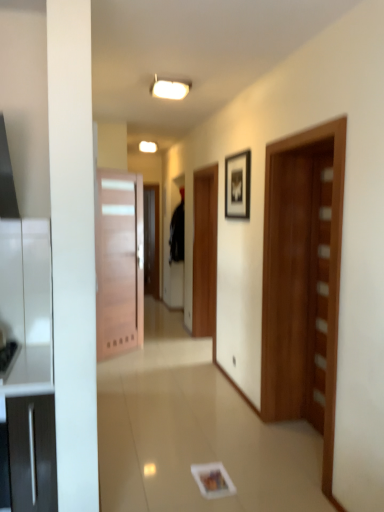
What is the approximate height of white glossy ceiling light at upper center?

2.76 inches.

Where is `wooden door at right, the first door viewed from the front`? Image resolution: width=384 pixels, height=512 pixels. wooden door at right, the first door viewed from the front is located at coordinates (302, 274).

What is the approximate height of black matte picture frame at upper center?

It is 22.66 inches.

Describe the element at coordinates (237, 186) in the screenshot. I see `black matte picture frame at upper center` at that location.

Find the location of a particular element. The height and width of the screenshot is (512, 384). wooden door at left, the 2th door from the front is located at coordinates (119, 263).

Describe the element at coordinates (119, 263) in the screenshot. This screenshot has width=384, height=512. I see `wooden door at left, which appears as the 2th door when viewed from the right` at that location.

Locate an element on the screen. white glossy ceiling light at upper center is located at coordinates (170, 88).

Is black fabric robe at center aimed at white glossy ceiling light at upper center?

No, black fabric robe at center does not turn towards white glossy ceiling light at upper center.

In terms of height, does black fabric robe at center look taller or shorter compared to white glossy ceiling light at upper center?

Clearly, black fabric robe at center is taller compared to white glossy ceiling light at upper center.

From the image's perspective, relative to white glossy ceiling light at upper center, is black fabric robe at center above or below?

Based on their image positions, black fabric robe at center is located beneath white glossy ceiling light at upper center.

Consider the image. Can you tell me how much black fabric robe at center and white glossy ceiling light at upper center differ in facing direction?

The angular difference between black fabric robe at center and white glossy ceiling light at upper center is 89.4 degrees.

Is wooden door at left, the 2th door from the front, shorter than white glossy ceiling light at upper center?

No, wooden door at left, the 2th door from the front, is not shorter than white glossy ceiling light at upper center.

Is wooden door at left, marked as the 1th door in a back-to-front arrangement, with white glossy ceiling light at upper center?

No, wooden door at left, marked as the 1th door in a back-to-front arrangement, is not making contact with white glossy ceiling light at upper center.

From a real-world perspective, which is physically above, wooden door at left, which ranks as the 1th door in left-to-right order, or white glossy ceiling light at upper center?

white glossy ceiling light at upper center is physically above.

Between wooden door at left, which ranks as the 1th door in left-to-right order, and white glossy ceiling light at upper center, which one has smaller size?

white glossy ceiling light at upper center.

Is point (135, 291) closer or farther from the camera than point (311, 211)?

Point (135, 291) appears to be farther away from the viewer than point (311, 211).

Can you confirm if wooden door at left, which appears as the 2th door when viewed from the right, is shorter than wooden door at right, which ranks as the first door in right-to-left order?

Correct, wooden door at left, which appears as the 2th door when viewed from the right, is not as tall as wooden door at right, which ranks as the first door in right-to-left order.

Which of these two, wooden door at left, which appears as the 2th door when viewed from the right, or wooden door at right, which ranks as the first door in right-to-left order, is bigger?

Bigger between the two is wooden door at right, which ranks as the first door in right-to-left order.

From a real-world perspective, is wooden door at left, marked as the 1th door in a back-to-front arrangement, positioned above or below wooden door at right, acting as the 2th door starting from the left?

wooden door at left, marked as the 1th door in a back-to-front arrangement, is below wooden door at right, acting as the 2th door starting from the left.

Is point (169, 79) closer or farther from the camera than point (126, 297)?

Point (169, 79) is positioned closer to the camera compared to point (126, 297).

Which object is further away from the camera taking this photo, white glossy ceiling light at upper center or wooden door at left, marked as the 1th door in a back-to-front arrangement?

wooden door at left, marked as the 1th door in a back-to-front arrangement, is further away from the camera.

From a real-world perspective, is white glossy ceiling light at upper center over wooden door at left, which appears as the 2th door when viewed from the right?

Yes, from a real-world perspective, white glossy ceiling light at upper center is above wooden door at left, which appears as the 2th door when viewed from the right.

Is white glossy ceiling light at upper center far from wooden door at right, acting as the 2th door starting from the left?

Indeed, white glossy ceiling light at upper center is not near wooden door at right, acting as the 2th door starting from the left.

From the picture: How different are the orientations of white glossy ceiling light at upper center and wooden door at right, which is counted as the 2th door, starting from the back, in degrees?

The facing directions of white glossy ceiling light at upper center and wooden door at right, which is counted as the 2th door, starting from the back, are 90.3 degrees apart.

Is white glossy ceiling light at upper center positioned with its back to wooden door at right, the first door viewed from the front?

No, white glossy ceiling light at upper center's orientation is not away from wooden door at right, the first door viewed from the front.

Is white glossy ceiling light at upper center further to camera compared to wooden door at right, which ranks as the first door in right-to-left order?

Yes, the depth of white glossy ceiling light at upper center is greater than that of wooden door at right, which ranks as the first door in right-to-left order.

Does black matte picture frame at upper center have a greater height compared to wooden door at left, which appears as the 2th door when viewed from the right?

No.

Is the depth of black matte picture frame at upper center less than that of wooden door at left, which appears as the 2th door when viewed from the right?

Yes, it is.

From a real-world perspective, is black matte picture frame at upper center on top of wooden door at left, marked as the 1th door in a back-to-front arrangement?

Correct, in the physical world, black matte picture frame at upper center is higher than wooden door at left, marked as the 1th door in a back-to-front arrangement.

Would you say black matte picture frame at upper center contains wooden door at left, which appears as the 2th door when viewed from the right?

No, wooden door at left, which appears as the 2th door when viewed from the right, is located outside of black matte picture frame at upper center.

Where is `robe that is above the wooden door at right, acting as the 2th door starting from the left (from the image's perspective)`? This screenshot has height=512, width=384. robe that is above the wooden door at right, acting as the 2th door starting from the left (from the image's perspective) is located at coordinates (177, 234).

Are black fabric robe at center and wooden door at right, acting as the 2th door starting from the left, beside each other?

No, black fabric robe at center is not in contact with wooden door at right, acting as the 2th door starting from the left.

From the image's perspective, is black fabric robe at center on wooden door at right, acting as the 2th door starting from the left?

Indeed, from the image's perspective, black fabric robe at center is shown above wooden door at right, acting as the 2th door starting from the left.

The image size is (384, 512). In the image, there is a black fabric robe at center. In order to click on light fixture above it (from the image's perspective) in this screenshot , I will do `click(170, 88)`.

Where is `light fixture that appears above the wooden door at left, the 2th door from the front (from a real-world perspective)`? light fixture that appears above the wooden door at left, the 2th door from the front (from a real-world perspective) is located at coordinates (170, 88).

Estimate the real-world distances between objects in this image. Which object is closer to white glossy ceiling light at upper center, wooden door at right, acting as the 2th door starting from the left, or black fabric robe at center?

The object closer to white glossy ceiling light at upper center is wooden door at right, acting as the 2th door starting from the left.

Which object lies further to the anchor point wooden door at left, which ranks as the 1th door in left-to-right order, black matte picture frame at upper center or wooden door at right, which ranks as the first door in right-to-left order?

Among the two, wooden door at right, which ranks as the first door in right-to-left order, is located further to wooden door at left, which ranks as the 1th door in left-to-right order.

When comparing their distances from black fabric robe at center, does white glossy ceiling light at upper center or black matte picture frame at upper center seem closer?

Among the two, black matte picture frame at upper center is located nearer to black fabric robe at center.

Considering their positions, is white glossy ceiling light at upper center positioned further to black matte picture frame at upper center than wooden door at left, the 2th door from the front?

wooden door at left, the 2th door from the front, is further to black matte picture frame at upper center.

Based on the photo, considering their positions, is wooden door at right, which is counted as the 2th door, starting from the back, positioned closer to wooden door at left, the 2th door from the front, than black fabric robe at center?

The object closer to wooden door at left, the 2th door from the front, is black fabric robe at center.

When comparing their distances from white glossy ceiling light at upper center, does black matte picture frame at upper center or wooden door at right, which is counted as the 2th door, starting from the back, seem further?

Based on the image, wooden door at right, which is counted as the 2th door, starting from the back, appears to be further to white glossy ceiling light at upper center.

Based on their spatial positions, is wooden door at left, the 2th door from the front, or black matte picture frame at upper center further from wooden door at right, acting as the 2th door starting from the left?

wooden door at left, the 2th door from the front, is further to wooden door at right, acting as the 2th door starting from the left.

Looking at the image, which one is located closer to black matte picture frame at upper center, black fabric robe at center or wooden door at left, the 2th door from the front?

wooden door at left, the 2th door from the front, lies closer to black matte picture frame at upper center than the other object.

Identify the location of picture frame positioned between wooden door at right, the first door viewed from the front, and wooden door at left, which appears as the 2th door when viewed from the right, from near to far. Image resolution: width=384 pixels, height=512 pixels. (237, 186).

Locate an element on the screen. Image resolution: width=384 pixels, height=512 pixels. door located between wooden door at right, which is counted as the 2th door, starting from the back, and black fabric robe at center in the depth direction is located at coordinates (119, 263).

Where is `light fixture between wooden door at right, acting as the 2th door starting from the left, and black fabric robe at center from front to back`? This screenshot has width=384, height=512. light fixture between wooden door at right, acting as the 2th door starting from the left, and black fabric robe at center from front to back is located at coordinates (170, 88).

Locate an element on the screen. This screenshot has height=512, width=384. picture frame between white glossy ceiling light at upper center and black fabric robe at center along the z-axis is located at coordinates (237, 186).